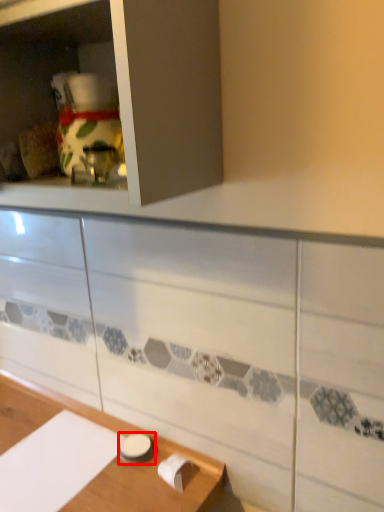
Question: From the image's perspective, what is the correct spatial relationship of tableware (annotated by the red box) in relation to cabinetry?

Choices:
 (A) below
 (B) above

Answer: (A)